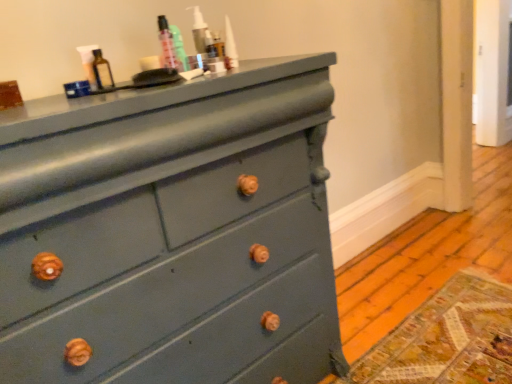
Question: Can you confirm if matte glass bottle at upper center is shorter than matte teal dresser at center?

Choices:
 (A) no
 (B) yes

Answer: (B)

Question: From the image's perspective, would you say matte glass bottle at upper center is shown under matte teal dresser at center?

Choices:
 (A) no
 (B) yes

Answer: (A)

Question: Can you confirm if matte glass bottle at upper center is smaller than matte teal dresser at center?

Choices:
 (A) yes
 (B) no

Answer: (A)

Question: Considering the relative sizes of matte glass bottle at upper center and matte teal dresser at center in the image provided, is matte glass bottle at upper center taller than matte teal dresser at center?

Choices:
 (A) no
 (B) yes

Answer: (A)

Question: Is matte glass bottle at upper center at the left side of matte teal dresser at center?

Choices:
 (A) yes
 (B) no

Answer: (A)

Question: Can matte teal dresser at center be found inside matte glass bottle at upper center?

Choices:
 (A) no
 (B) yes

Answer: (A)

Question: Is the surface of teal glossy bottle at upper center in direct contact with matte teal dresser at center?

Choices:
 (A) yes
 (B) no

Answer: (B)

Question: Is teal glossy bottle at upper center outside matte teal dresser at center?

Choices:
 (A) no
 (B) yes

Answer: (B)

Question: Are teal glossy bottle at upper center and matte teal dresser at center far apart?

Choices:
 (A) no
 (B) yes

Answer: (A)

Question: Can you confirm if teal glossy bottle at upper center is wider than matte teal dresser at center?

Choices:
 (A) yes
 (B) no

Answer: (B)

Question: From a real-world perspective, is teal glossy bottle at upper center under matte teal dresser at center?

Choices:
 (A) yes
 (B) no

Answer: (B)

Question: Considering the relative positions of teal glossy bottle at upper center and matte teal dresser at center in the image provided, is teal glossy bottle at upper center to the left of matte teal dresser at center from the viewer's perspective?

Choices:
 (A) no
 (B) yes

Answer: (A)

Question: Is matte glass bottle at upper center not near teal glossy bottle at upper center?

Choices:
 (A) yes
 (B) no

Answer: (B)